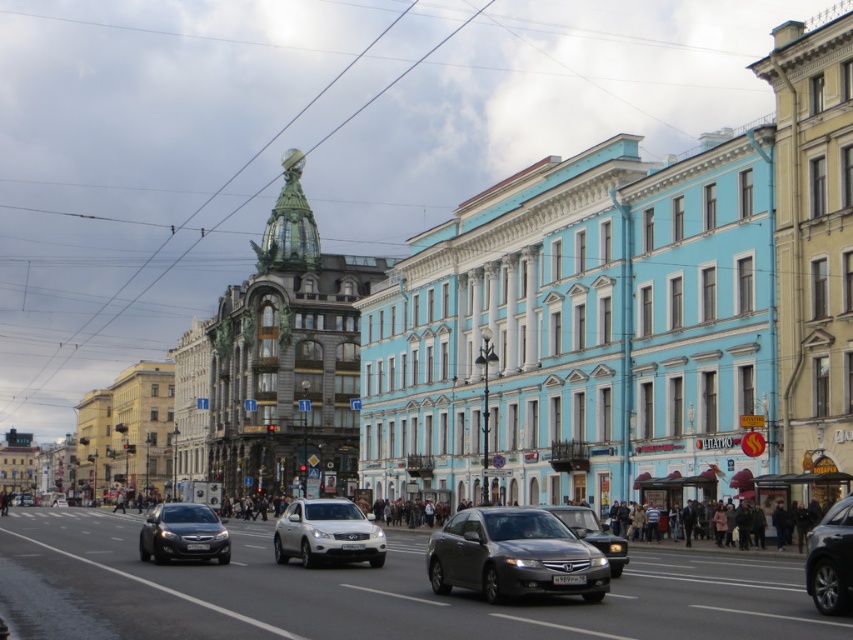
Question: Which point is farther to the camera?

Choices:
 (A) (840, 516)
 (B) (514, 563)

Answer: (B)

Question: Which is nearer to the metallic gray sedan at center?

Choices:
 (A) shiny silver sedan at center
 (B) satin silver suv at center

Answer: (A)

Question: Does satin silver suv at center appear over shiny black sedan at center?

Choices:
 (A) no
 (B) yes

Answer: (B)

Question: Does metallic gray sedan at center appear under shiny silver sedan at center?

Choices:
 (A) no
 (B) yes

Answer: (A)

Question: Which object is the farthest from the shiny silver sedan at center?

Choices:
 (A) shiny black car at lower right
 (B) metallic gray sedan at center
 (C) shiny black sedan at center

Answer: (C)

Question: Observing the image, what is the correct spatial positioning of metallic gray sedan at center in reference to shiny black car at lower right?

Choices:
 (A) right
 (B) left

Answer: (B)